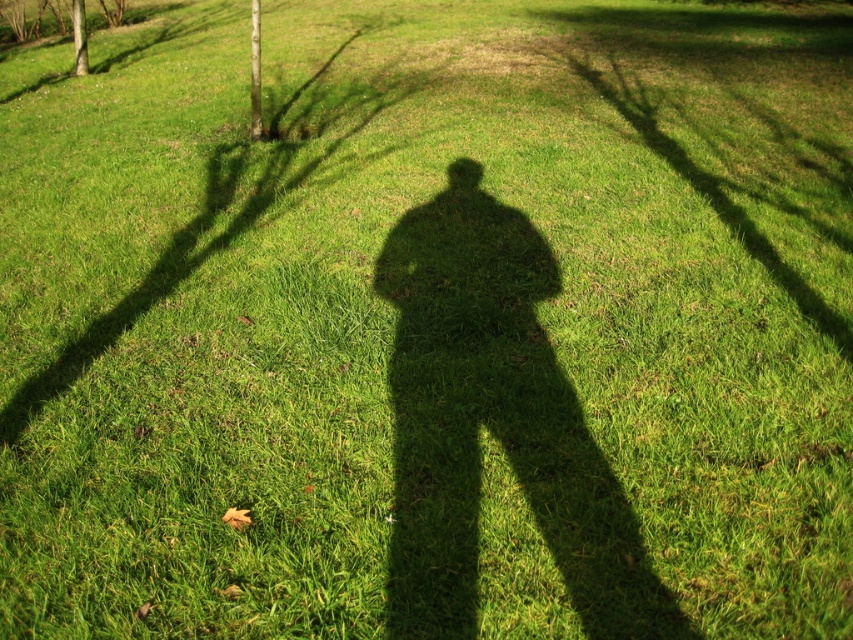
Question: From the image, what is the correct spatial relationship of green leafy tree at upper left in relation to smooth brown tree trunk at upper left?

Choices:
 (A) left
 (B) right

Answer: (B)

Question: Which point is closer to the camera?

Choices:
 (A) green leafy tree at upper left
 (B) smooth brown tree trunk at upper left

Answer: (A)

Question: Which point is farther to the camera?

Choices:
 (A) (259, 102)
 (B) (79, 29)

Answer: (B)

Question: Which point is farther to the camera?

Choices:
 (A) (83, 65)
 (B) (258, 74)

Answer: (A)

Question: Can you confirm if green leafy tree at upper left is positioned above smooth brown tree trunk at upper left?

Choices:
 (A) yes
 (B) no

Answer: (A)

Question: Is green leafy tree at upper left bigger than smooth brown tree trunk at upper left?

Choices:
 (A) no
 (B) yes

Answer: (B)